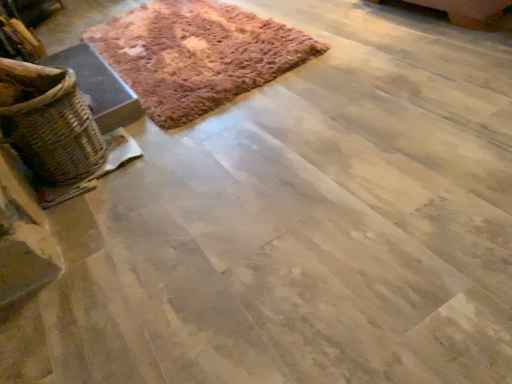
The image size is (512, 384). In order to click on brown textured rug at upper left in this screenshot , I will do `click(197, 55)`.

The height and width of the screenshot is (384, 512). What do you see at coordinates (197, 55) in the screenshot?
I see `brown textured rug at upper left` at bounding box center [197, 55].

This screenshot has height=384, width=512. What do you see at coordinates (50, 123) in the screenshot? I see `woven brown basket at left` at bounding box center [50, 123].

You are a GUI agent. You are given a task and a screenshot of the screen. Output one action in this format:
    pyautogui.click(x=<x>, y=<y>)
    Task: Click on the woven brown basket at left
    
    Given the screenshot: What is the action you would take?
    pyautogui.click(x=50, y=123)

Measure the distance between point (69, 150) and camera.

Point (69, 150) is 1.48 meters from camera.

Identify the location of brown textured rug at upper left. click(197, 55).

Considering the relative positions of brown textured rug at upper left and woven brown basket at left in the image provided, is brown textured rug at upper left to the left or to the right of woven brown basket at left?

From the image, it's evident that brown textured rug at upper left is to the right of woven brown basket at left.

Considering the relative positions of brown textured rug at upper left and woven brown basket at left in the image provided, is brown textured rug at upper left behind woven brown basket at left?

That is True.

Which is closer, (x=137, y=88) or (x=59, y=116)?

Point (x=137, y=88).

From the image's perspective, which one is positioned lower, brown textured rug at upper left or woven brown basket at left?

woven brown basket at left appears lower in the image.

From a real-world perspective, is brown textured rug at upper left located higher than woven brown basket at left?

No, from a real-world perspective, brown textured rug at upper left is not on top of woven brown basket at left.

Considering the sizes of brown textured rug at upper left and woven brown basket at left in the image, is brown textured rug at upper left wider or thinner than woven brown basket at left?

Considering their sizes, brown textured rug at upper left looks broader than woven brown basket at left.

Which of these two, brown textured rug at upper left or woven brown basket at left, stands shorter?

brown textured rug at upper left is shorter.

In terms of size, does brown textured rug at upper left appear bigger or smaller than woven brown basket at left?

In the image, brown textured rug at upper left appears to be larger than woven brown basket at left.

Would you say brown textured rug at upper left is outside woven brown basket at left?

brown textured rug at upper left lies outside woven brown basket at left's area.

Consider the image. Is brown textured rug at upper left far from woven brown basket at left?

They are positioned close to each other.

Is brown textured rug at upper left turned away from woven brown basket at left?

No, brown textured rug at upper left is not facing away from woven brown basket at left.

Locate an element on the screen. Image resolution: width=512 pixels, height=384 pixels. mat behind the woven brown basket at left is located at coordinates (197, 55).

Is woven brown basket at left to the left or to the right of brown textured rug at upper left in the image?

woven brown basket at left is positioned on brown textured rug at upper left's left side.

Is woven brown basket at left closer to the viewer compared to brown textured rug at upper left?

That is True.

Which is less distant, (35, 161) or (159, 42)?

Point (35, 161) appears to be closer to the viewer than point (159, 42).

From the image's perspective, does woven brown basket at left appear lower than brown textured rug at upper left?

Yes, from the image's perspective, woven brown basket at left is below brown textured rug at upper left.

From a real-world perspective, is woven brown basket at left above or below brown textured rug at upper left?

Clearly, from a real-world perspective, woven brown basket at left is above brown textured rug at upper left.

Considering the sizes of objects woven brown basket at left and brown textured rug at upper left in the image provided, who is wider, woven brown basket at left or brown textured rug at upper left?

With larger width is brown textured rug at upper left.

In terms of height, does woven brown basket at left look taller or shorter compared to brown textured rug at upper left?

Clearly, woven brown basket at left is taller compared to brown textured rug at upper left.

Can you confirm if woven brown basket at left is smaller than brown textured rug at upper left?

Correct, woven brown basket at left occupies less space than brown textured rug at upper left.

Is brown textured rug at upper left surrounded by woven brown basket at left?

No, brown textured rug at upper left is not inside woven brown basket at left.

Are woven brown basket at left and brown textured rug at upper left located far from each other?

No, woven brown basket at left is not far away from brown textured rug at upper left.

Is woven brown basket at left aimed at brown textured rug at upper left?

No, woven brown basket at left is not turned towards brown textured rug at upper left.

Can you tell me how much woven brown basket at left and brown textured rug at upper left differ in facing direction?

They differ by 2.86 degrees in their facing directions.

This screenshot has width=512, height=384. In order to click on mat directly beneath the woven brown basket at left (from a real-world perspective) in this screenshot , I will do `click(197, 55)`.

In order to click on mat on the right of the woven brown basket at left in this screenshot , I will do `click(197, 55)`.

This screenshot has width=512, height=384. What are the coordinates of `basket on the left of brown textured rug at upper left` in the screenshot? It's located at (50, 123).